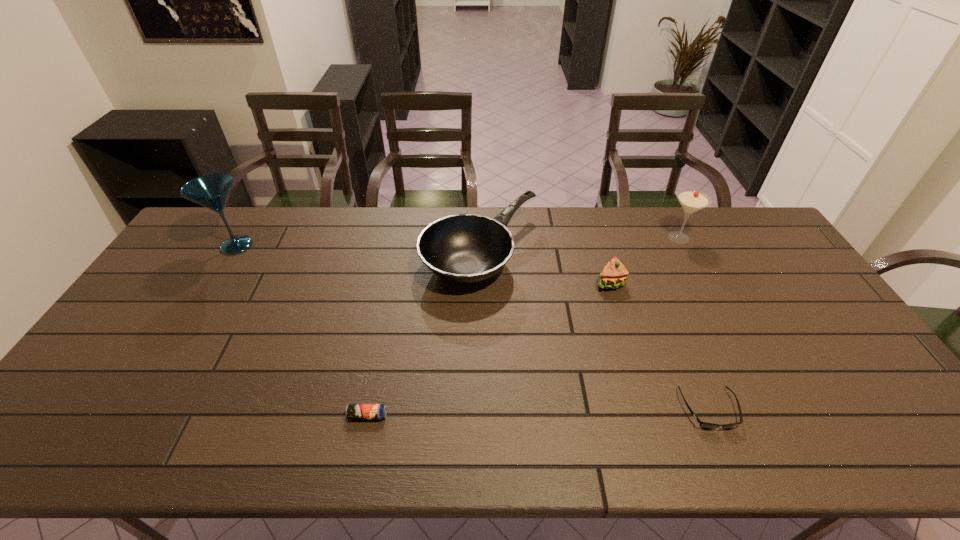
Identify the location of free spot between the third object from left to right and the second tallest object. (580, 246).

Where is `free space between the fourth shortest object and the left martini`? Image resolution: width=960 pixels, height=540 pixels. free space between the fourth shortest object and the left martini is located at coordinates tap(358, 249).

Identify the location of vacant space in between the sandwich and the beer can. This screenshot has height=540, width=960. click(489, 349).

This screenshot has height=540, width=960. Find the location of `vacant area that lies between the rightmost object and the sunglasses`. vacant area that lies between the rightmost object and the sunglasses is located at coordinates (694, 323).

This screenshot has width=960, height=540. Find the location of `object that stands as the second closest to the second object from right to left`. object that stands as the second closest to the second object from right to left is located at coordinates (463, 248).

Choose which object is the fourth nearest neighbor to the fifth object from right to left. Please provide its 2D coordinates. Your answer should be formatted as a tuple, i.e. [(x, y)], where the tuple contains the x and y coordinates of a point satisfying the conditions above.

[(705, 425)]

Where is `vacant space that satisfies the following two spatial constraints: 1. on the back side of the shorter martini; 2. on the right side of the sandwich`? The height and width of the screenshot is (540, 960). vacant space that satisfies the following two spatial constraints: 1. on the back side of the shorter martini; 2. on the right side of the sandwich is located at coordinates (596, 238).

Identify the location of free region that satisfies the following two spatial constraints: 1. on the back side of the third object from left to right; 2. on the left side of the fifth object from right to left. (x=400, y=254).

What are the coordinates of `vacant space that satisfies the following two spatial constraints: 1. on the front side of the left martini; 2. on the right side of the fourth object from left to right` in the screenshot? It's located at point(214,281).